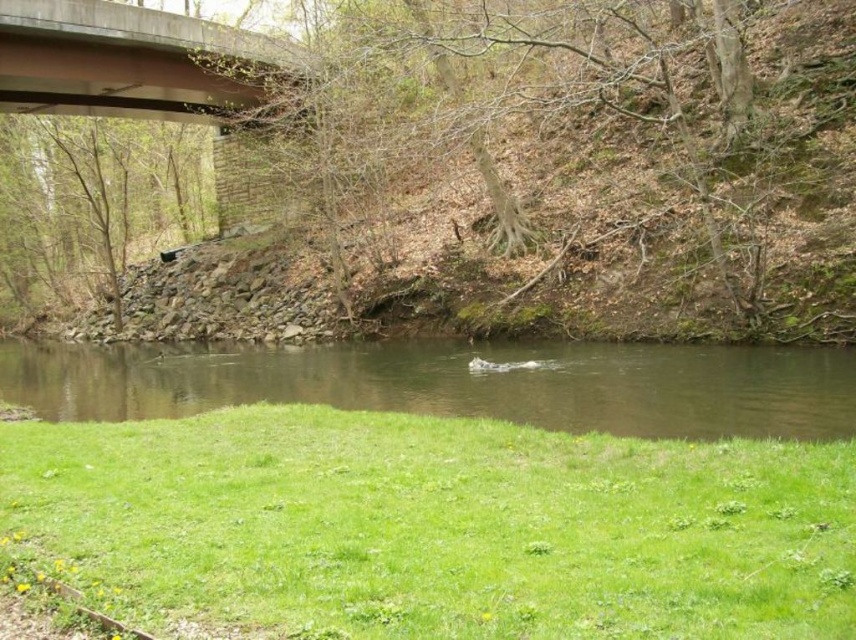
Question: Observing the image, what is the correct spatial positioning of brown murky water at center in reference to concrete at upper center?

Choices:
 (A) below
 (B) above

Answer: (A)

Question: Which of the following is the farthest from the observer?

Choices:
 (A) (648, 424)
 (B) (343, 584)
 (C) (55, 13)

Answer: (C)

Question: Can you confirm if green grass at lower center is thinner than brown murky water at center?

Choices:
 (A) no
 (B) yes

Answer: (B)

Question: Which is farther from the concrete at upper center?

Choices:
 (A) brown murky water at center
 (B) green grass at lower center

Answer: (B)

Question: Among these objects, which one is nearest to the camera?

Choices:
 (A) concrete at upper center
 (B) brown murky water at center
 (C) green grass at lower center

Answer: (C)

Question: Is green grass at lower center thinner than brown murky water at center?

Choices:
 (A) no
 (B) yes

Answer: (B)